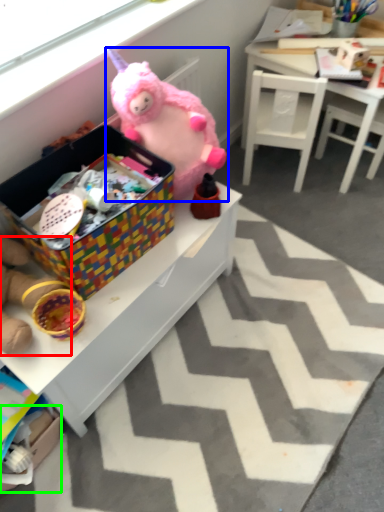
Question: Which object is the farthest from toy (highlighted by a red box)? Choose among these: toy (highlighted by a blue box) or cardboard box (highlighted by a green box).

Choices:
 (A) toy
 (B) cardboard box

Answer: (A)